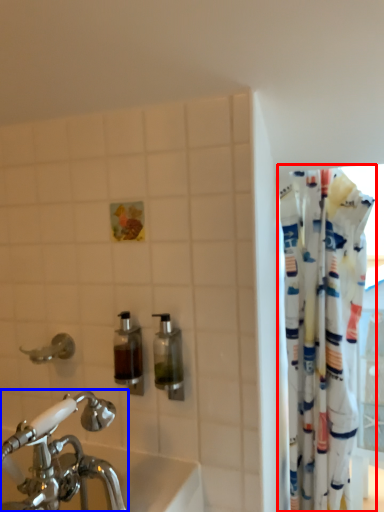
Question: Which point is closer to the camera, curtain (highlighted by a red box) or tap (highlighted by a blue box)?

Choices:
 (A) curtain
 (B) tap

Answer: (B)